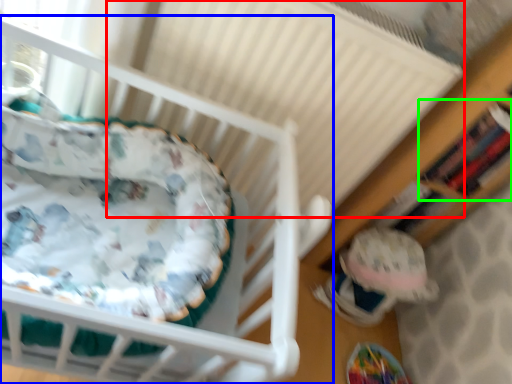
Question: Which object is positioned farthest from radiator (highlighted by a red box)? Select from infant bed (highlighted by a blue box) and shelf (highlighted by a green box).

Choices:
 (A) infant bed
 (B) shelf

Answer: (B)